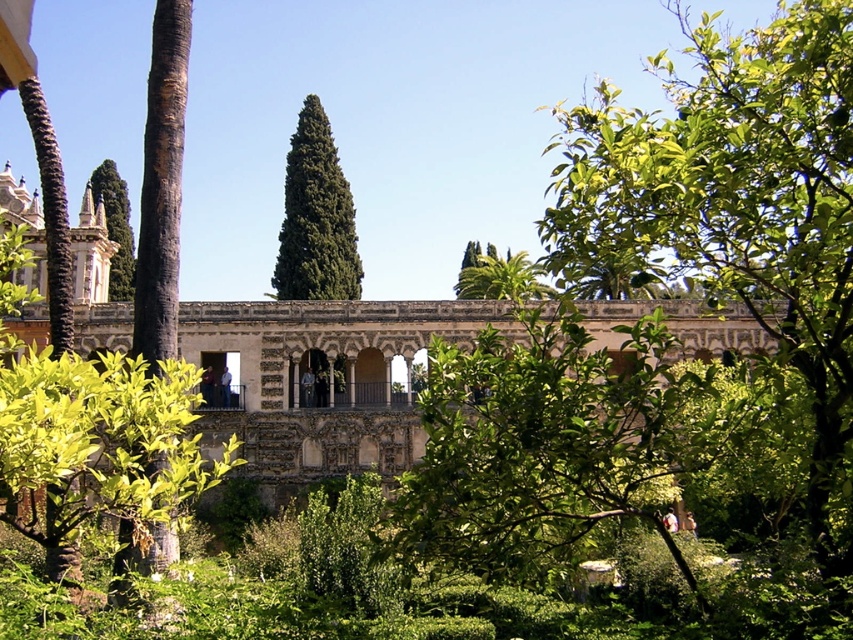
From the picture: Is stone arches at center thinner than green textured tree at center?

In fact, stone arches at center might be wider than green textured tree at center.

Is point (315, 333) positioned before point (315, 195)?

Yes, it is in front of point (315, 195).

The width and height of the screenshot is (853, 640). In order to click on stone arches at center in this screenshot , I will do `click(321, 378)`.

Can you confirm if green leafy tree at center is bigger than green leafy tree at left?

Yes, green leafy tree at center is bigger than green leafy tree at left.

Is point (840, 125) positioned before point (105, 182)?

Yes, it is in front of point (105, 182).

The width and height of the screenshot is (853, 640). What are the coordinates of `green leafy tree at center` in the screenshot? It's located at (740, 202).

Who is higher up, green leafy tree at center or green textured tree at center?

green leafy tree at center is above.

What do you see at coordinates (740, 202) in the screenshot? The height and width of the screenshot is (640, 853). I see `green leafy tree at center` at bounding box center [740, 202].

Does point (770, 97) lie behind point (297, 284)?

No, (770, 97) is closer to viewer.

What are the coordinates of `green leafy tree at center` in the screenshot? It's located at (740, 202).